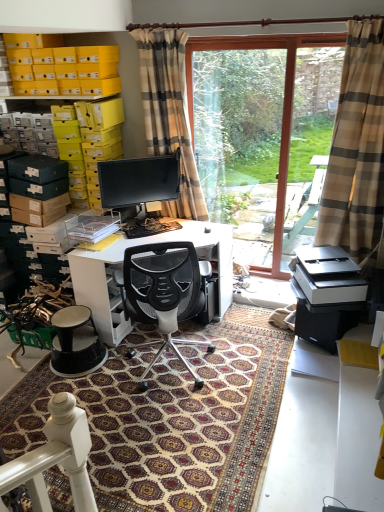
The image size is (384, 512). Describe the element at coordinates (122, 262) in the screenshot. I see `white glossy desk at center` at that location.

You are a GUI agent. You are given a task and a screenshot of the screen. Output one action in this format:
    pyautogui.click(x=<x>, y=<y>)
    Task: Click on the patterned carpet at center
    The image size is (384, 512).
    Given the screenshot: What is the action you would take?
    pyautogui.click(x=169, y=420)

In order to face yellow cardboard boxes at upper left, should I rotate leftwards or rightwards?

It's best to rotate left around 16.721 degrees.

This screenshot has height=512, width=384. What do you see at coordinates (61, 67) in the screenshot?
I see `yellow cardboard boxes at upper left` at bounding box center [61, 67].

Locate an element on the screen. The height and width of the screenshot is (512, 384). white matte printer at lower right is located at coordinates (326, 294).

The height and width of the screenshot is (512, 384). Find the location of `chair below the white matte printer at lower right (from a real-world perspective)`. chair below the white matte printer at lower right (from a real-world perspective) is located at coordinates (162, 292).

Considering the positions of point (150, 310) and point (310, 254), is point (150, 310) closer or farther from the camera than point (310, 254)?

Point (150, 310) is closer to the camera than point (310, 254).

Based on the photo, is black mesh office chair at center positioned with its back to white matte printer at lower right?

No.

Would you consider white glossy desk at center to be distant from matte black monitor at center?

white glossy desk at center is near matte black monitor at center, not far away.

From the image's perspective, is white glossy desk at center below matte black monitor at center?

Yes, from the image's perspective, white glossy desk at center is beneath matte black monitor at center.

Considering the sizes of objects white glossy desk at center and matte black monitor at center in the image provided, who is smaller, white glossy desk at center or matte black monitor at center?

matte black monitor at center.

What's the angular difference between white glossy desk at center and matte black monitor at center's facing directions?

They differ by 41.9 degrees in their facing directions.

Consider the image. Between beige plaid curtain at right, the first curtain when ordered from right to left, and patterned carpet at center, which one has smaller size?

Smaller between the two is patterned carpet at center.

Which of these two, beige plaid curtain at right, the first curtain when ordered from right to left, or patterned carpet at center, stands shorter?

Standing shorter between the two is patterned carpet at center.

Is beige plaid curtain at right, the first curtain when ordered from right to left, at the right side of patterned carpet at center?

Yes.

Find the location of a particular element. Image resolution: width=384 pixels, height=512 pixels. curtain in front of the black mesh office chair at center is located at coordinates (356, 148).

Which point is more forward, (377,96) or (183,341)?

Positioned in front is point (377,96).

Does beige plaid curtain at right, the first curtain when ordered from right to left, appear on the right side of black mesh office chair at center?

Yes, beige plaid curtain at right, the first curtain when ordered from right to left, is to the right of black mesh office chair at center.

In the image, is beige plaid curtain at right, marked as the 2th curtain in a left-to-right arrangement, positioned in front of or behind black mesh office chair at center?

Clearly, beige plaid curtain at right, marked as the 2th curtain in a left-to-right arrangement, is in front of black mesh office chair at center.

Considering the relative sizes of white glossy desk at center and transparent glass door at center in the image provided, is white glossy desk at center bigger than transparent glass door at center?

Yes, white glossy desk at center is bigger than transparent glass door at center.

Is white glossy desk at center oriented towards transparent glass door at center?

No, white glossy desk at center is not oriented towards transparent glass door at center.

Is white glossy desk at center wider than transparent glass door at center?

Yes.

Which is more to the right, white matte printer at lower right or matte black monitor at center?

From the viewer's perspective, white matte printer at lower right appears more on the right side.

Could you tell me if white matte printer at lower right is facing matte black monitor at center?

No, white matte printer at lower right is not aimed at matte black monitor at center.

From the image's perspective, does white matte printer at lower right appear higher than matte black monitor at center?

No, from the image's perspective, white matte printer at lower right is not on top of matte black monitor at center.

From a real-world perspective, between patterned carpet at center and white matte printer at lower right, who is vertically lower?

patterned carpet at center.

From the image's perspective, which one is positioned lower, patterned carpet at center or white matte printer at lower right?

patterned carpet at center.

Is patterned carpet at center with white matte printer at lower right?

No, patterned carpet at center is not with white matte printer at lower right.

The image size is (384, 512). I want to click on printer above the black mesh office chair at center (from a real-world perspective), so click(326, 294).

You are a GUI agent. You are given a task and a screenshot of the screen. Output one action in this format:
    pyautogui.click(x=<x>, y=<y>)
    Task: Click on the computer monitor behind the white glossy desk at center
    The image size is (384, 512).
    Given the screenshot: What is the action you would take?
    pyautogui.click(x=139, y=180)

Estimate the real-world distances between objects in this image. Which object is closer to matte black monitor at center, transparent glass door at center or patterned carpet at center?

Among the two, transparent glass door at center is located nearer to matte black monitor at center.

Based on their spatial positions, is beige plaid curtain at right, the first curtain when ordered from right to left, or yellow cardboard boxes at upper left closer to patterned carpet at center?

beige plaid curtain at right, the first curtain when ordered from right to left.

Based on their spatial positions, is matte black monitor at center or black mesh office chair at center further from white glossy desk at center?

black mesh office chair at center lies further to white glossy desk at center than the other object.

Estimate the real-world distances between objects in this image. Which object is further from matte black monitor at center, white glossy desk at center or patterned carpet at center?

Based on the image, patterned carpet at center appears to be further to matte black monitor at center.

Looking at the image, which one is located closer to white glossy desk at center, transparent glass door at center or white matte printer at lower right?

Based on the image, white matte printer at lower right appears to be nearer to white glossy desk at center.

Estimate the real-world distances between objects in this image. Which object is further from matte black monitor at center, transparent glass door at center or yellow cardboard boxes at upper left?

transparent glass door at center lies further to matte black monitor at center than the other object.

From the image, which object appears to be nearer to matte black monitor at center, transparent glass door at center or white matte printer at lower right?

transparent glass door at center is closer to matte black monitor at center.

Considering their positions, is white glossy desk at center positioned closer to yellow cardboard boxes at upper left than transparent glass door at center?

transparent glass door at center lies closer to yellow cardboard boxes at upper left than the other object.

The width and height of the screenshot is (384, 512). I want to click on curtain between yellow cardboard boxes at upper left and transparent glass door at center from left to right, so click(x=169, y=113).

Identify the location of computer monitor between transparent glass door at center and patterned carpet at center from top to bottom. Image resolution: width=384 pixels, height=512 pixels. (139, 180).

Locate an element on the screen. Image resolution: width=384 pixels, height=512 pixels. computer monitor between yellow cardboard boxes at upper left and patterned carpet at center in the up-down direction is located at coordinates pyautogui.click(x=139, y=180).

The width and height of the screenshot is (384, 512). I want to click on glass door between plaid fabric curtain at center, which is the 2th curtain from right to left, and white glossy desk at center, in the vertical direction, so click(283, 103).